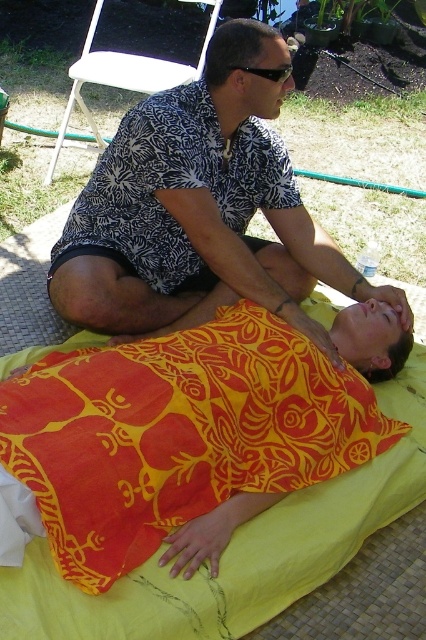
Is yellow woven mat at lower center to the right of black plastic sunglasses at upper center from the viewer's perspective?

Correct, you'll find yellow woven mat at lower center to the right of black plastic sunglasses at upper center.

Is point (157, 611) farther from viewer compared to point (271, 77)?

No, it is in front of (271, 77).

Between point (331, 529) and point (271, 70), which one is positioned behind?

The point (271, 70) is behind.

Where is `yellow woven mat at lower center`? The height and width of the screenshot is (640, 426). yellow woven mat at lower center is located at coordinates (238, 554).

Image resolution: width=426 pixels, height=640 pixels. What do you see at coordinates (201, 211) in the screenshot?
I see `printed fabric shirt at upper center` at bounding box center [201, 211].

Between point (250, 291) and point (371, 476), which one is positioned in front?

Point (371, 476) is in front.

Where is `printed fabric shirt at upper center`? The height and width of the screenshot is (640, 426). printed fabric shirt at upper center is located at coordinates (201, 211).

Is point (140, 173) farther from camera compared to point (290, 76)?

Yes, point (140, 173) is behind point (290, 76).

Does printed fabric shirt at upper center have a larger size compared to black plastic sunglasses at upper center?

Yes.

I want to click on printed fabric shirt at upper center, so click(201, 211).

Where is `printed fabric shirt at upper center`? Image resolution: width=426 pixels, height=640 pixels. printed fabric shirt at upper center is located at coordinates (201, 211).